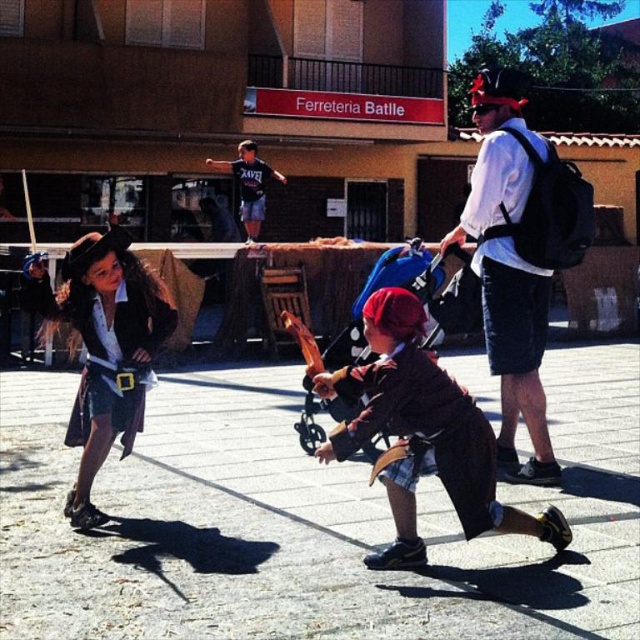
Question: Does white cotton shirt at upper center have a larger size compared to shiny black pirate costume at left?

Choices:
 (A) no
 (B) yes

Answer: (A)

Question: Observing the image, what is the correct spatial positioning of white cotton shirt at upper center in reference to blue fabric stroller at center?

Choices:
 (A) left
 (B) right

Answer: (B)

Question: Which point is farther to the camera?

Choices:
 (A) brown woolen coat at center
 (B) shiny black pirate costume at left
 (C) white cotton shirt at upper center
 (D) blue fabric stroller at center

Answer: (C)

Question: Which point appears closest to the camera in this image?

Choices:
 (A) (513, 340)
 (B) (378, 282)
 (C) (164, 296)

Answer: (C)

Question: Can you confirm if brown woolen coat at center is wider than blue fabric stroller at center?

Choices:
 (A) no
 (B) yes

Answer: (B)

Question: Which point is closer to the camera taking this photo?

Choices:
 (A) (339, 403)
 (B) (65, 305)
 (C) (392, 362)
 (D) (544, 449)

Answer: (C)